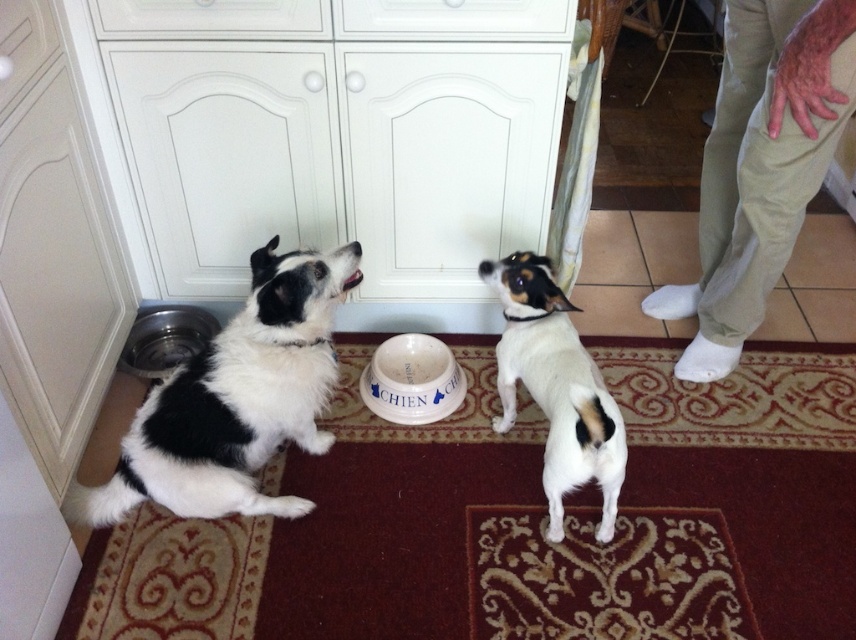
Question: Which point is farther to the camera?

Choices:
 (A) black and white fur dog at left
 (B) white fur dog at center

Answer: (A)

Question: Does white ceramic bowl at center come in front of metallic silver bowl at lower left?

Choices:
 (A) no
 (B) yes

Answer: (B)

Question: Is black and white fur dog at left smaller than white fur dog at center?

Choices:
 (A) no
 (B) yes

Answer: (A)

Question: Which object is positioned closest to the white fur dog at center?

Choices:
 (A) black and white fur dog at left
 (B) metallic silver bowl at lower left
 (C) white ceramic bowl at center
 (D) white glossy cabinet at upper center

Answer: (C)

Question: Can you confirm if white glossy cabinet at upper center is positioned below metallic silver bowl at lower left?

Choices:
 (A) no
 (B) yes

Answer: (A)

Question: Among these objects, which one is farthest from the camera?

Choices:
 (A) white fur dog at center
 (B) black and white fur dog at left
 (C) white glossy cabinet at upper center
 (D) metallic silver bowl at lower left

Answer: (D)